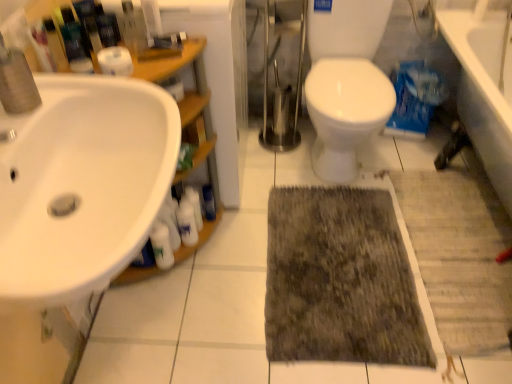
The height and width of the screenshot is (384, 512). What are the coordinates of `free spot above dark gray shaggy rug at center (from a real-world perspective)` in the screenshot? It's located at (344, 258).